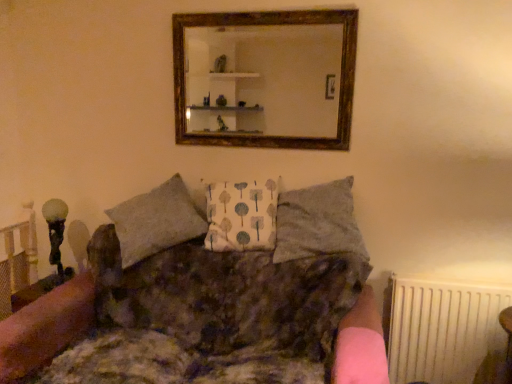
Question: From a real-world perspective, is white fabric pillow at center, placed as the first pillow when sorted from left to right, over white plastic radiator at lower right?

Choices:
 (A) no
 (B) yes

Answer: (B)

Question: Can you confirm if white fabric pillow at center, placed as the first pillow when sorted from left to right, is wider than white plastic radiator at lower right?

Choices:
 (A) no
 (B) yes

Answer: (B)

Question: Can you confirm if white fabric pillow at center, placed as the first pillow when sorted from left to right, is positioned to the left of white plastic radiator at lower right?

Choices:
 (A) no
 (B) yes

Answer: (B)

Question: From the image's perspective, is white fabric pillow at center, placed as the second pillow when sorted from right to left, below white plastic radiator at lower right?

Choices:
 (A) yes
 (B) no

Answer: (B)

Question: Can you confirm if white fabric pillow at center, placed as the first pillow when sorted from left to right, is positioned to the right of white plastic radiator at lower right?

Choices:
 (A) yes
 (B) no

Answer: (B)

Question: Is white fabric pillow at center, placed as the second pillow when sorted from right to left, turned away from white plastic radiator at lower right?

Choices:
 (A) yes
 (B) no

Answer: (B)

Question: Does textured brown fabric couch at center have a greater height compared to white fabric pillow at center, placed as the first pillow when sorted from left to right?

Choices:
 (A) no
 (B) yes

Answer: (B)

Question: Can you confirm if textured brown fabric couch at center is shorter than white fabric pillow at center, placed as the first pillow when sorted from left to right?

Choices:
 (A) no
 (B) yes

Answer: (A)

Question: Considering the relative sizes of textured brown fabric couch at center and white fabric pillow at center, placed as the first pillow when sorted from left to right, in the image provided, is textured brown fabric couch at center bigger than white fabric pillow at center, placed as the first pillow when sorted from left to right,?

Choices:
 (A) yes
 (B) no

Answer: (A)

Question: Considering the relative sizes of textured brown fabric couch at center and white fabric pillow at center, placed as the second pillow when sorted from right to left, in the image provided, is textured brown fabric couch at center smaller than white fabric pillow at center, placed as the second pillow when sorted from right to left,?

Choices:
 (A) no
 (B) yes

Answer: (A)

Question: Is the depth of textured brown fabric couch at center less than that of white fabric pillow at center, placed as the first pillow when sorted from left to right?

Choices:
 (A) no
 (B) yes

Answer: (B)

Question: Is textured brown fabric couch at center at the right side of white fabric pillow at center, placed as the second pillow when sorted from right to left?

Choices:
 (A) yes
 (B) no

Answer: (B)

Question: Is the position of textured gray pillow at center, which is the 1th pillow from right to left, more distant than that of textured brown fabric couch at center?

Choices:
 (A) yes
 (B) no

Answer: (A)